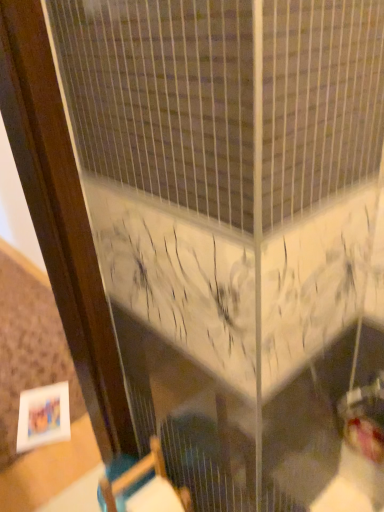
You are a GUI agent. You are given a task and a screenshot of the screen. Output one action in this format:
    pyautogui.click(x=<x>, y=<y>)
    Task: Click on the vacant point above white matte picture frame at lower left (from a real-world perspective)
    This screenshot has width=384, height=512.
    Given the screenshot: What is the action you would take?
    pyautogui.click(x=42, y=422)